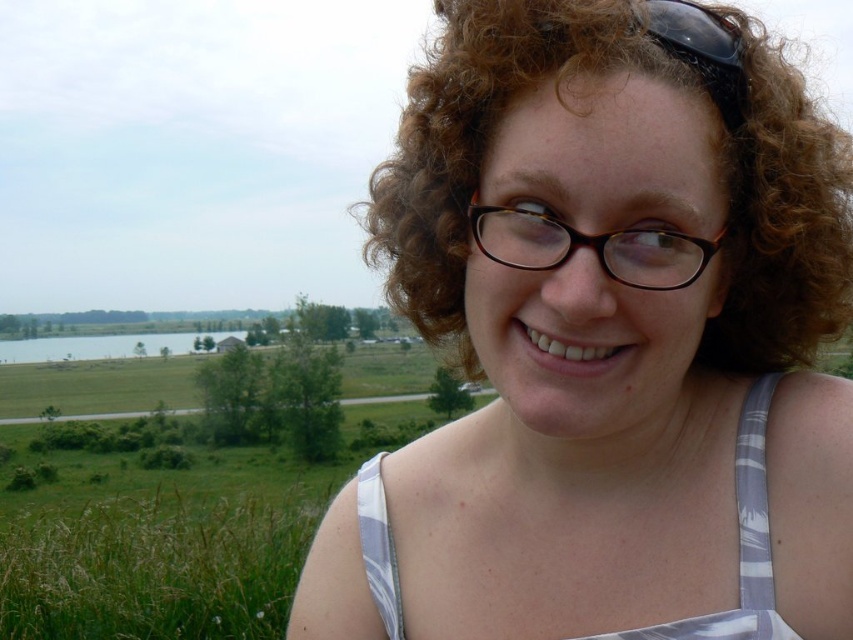
You are standing in the scene described. You see a point at coordinates (740,544). What object is located at that point?

The point at coordinates (740,544) corresponds to the white striped fabric dress at center.

You are a photographer adjusting your camera settings to focus on two points in the scene. The first point is point [751,464] and the second is point [492,248]. Which point should you focus on first if you want to ensure both are in focus, considering their depth?

You should focus on point [492,248] first because it is closer to the camera than point [751,464]. By focusing on the closer point, the depth of field may extend to include the farther point as well.

From the picture: You are a fashion designer observing the scene. You notice the white striped fabric dress at center and the black plastic glasses at center. Which item is positioned higher up on the person?

The white striped fabric dress at center is taller than black plastic glasses at center, so the dress is positioned higher up on the person.